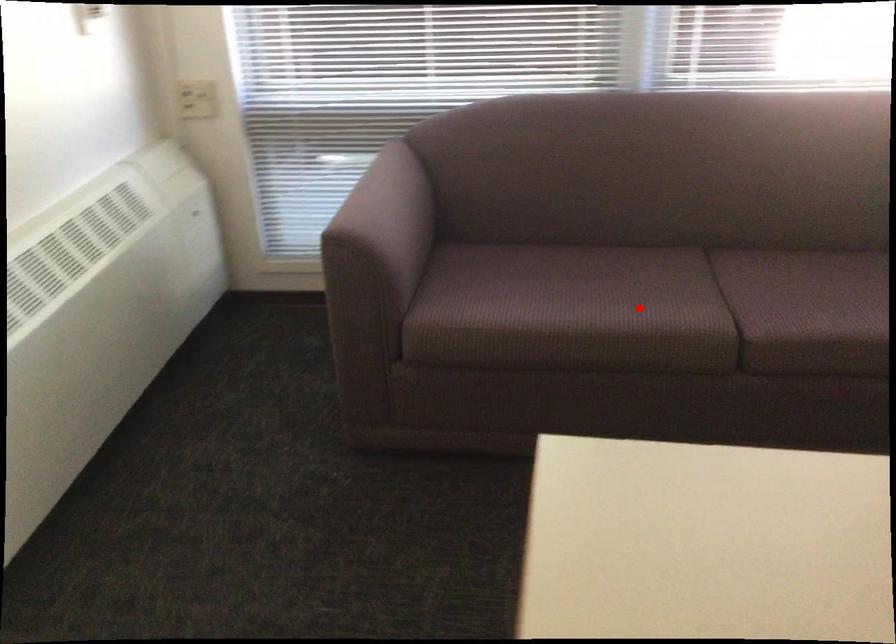
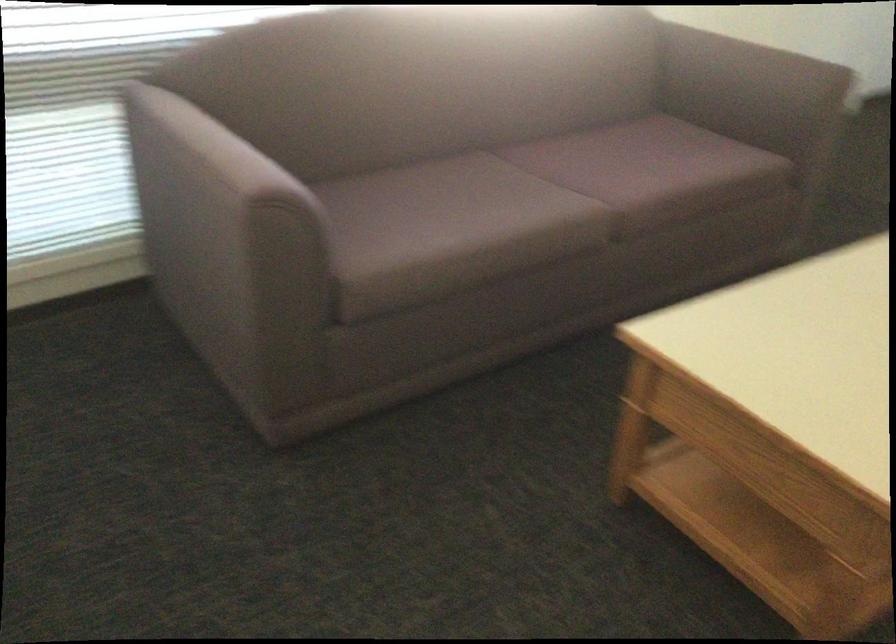
Locate, in the second image, the point that corresponds to the highlighted location in the first image.

(528, 205)